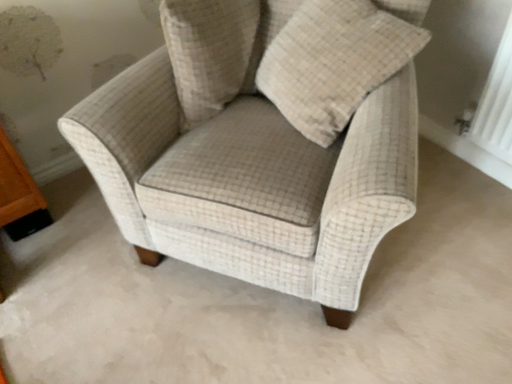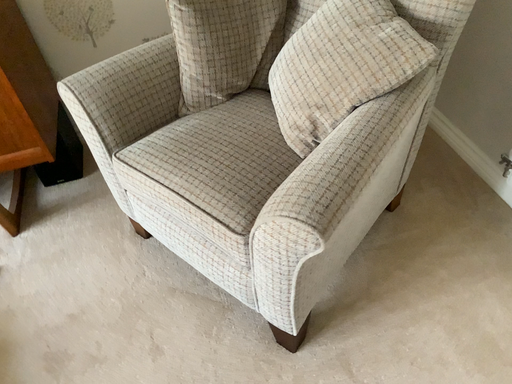
Question: How did the camera likely rotate when shooting the video?

Choices:
 (A) rotated right
 (B) rotated left

Answer: (B)